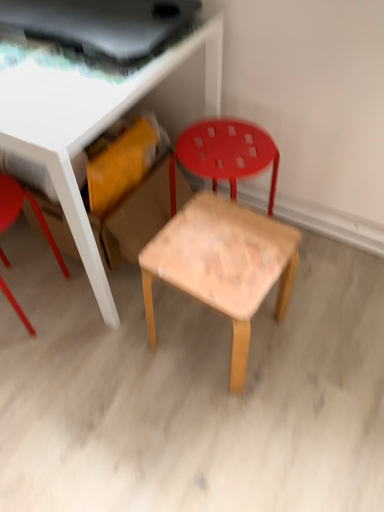
Locate an element on the screen. The width and height of the screenshot is (384, 512). vacant location below matte red stool at left, which is the 1th chair from left to right (from a real-world perspective) is located at coordinates (19, 306).